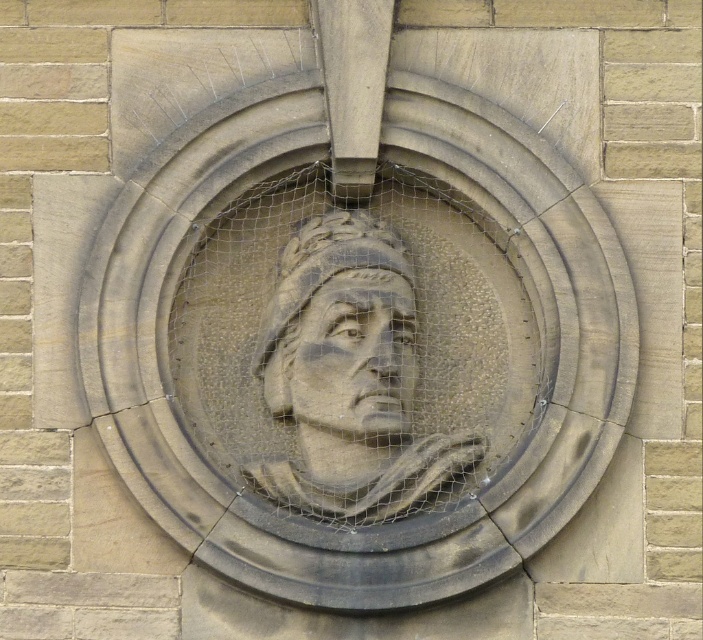
Question: Is stone carving of man at center positioned in front of stone carving head at center?

Choices:
 (A) no
 (B) yes

Answer: (B)

Question: Is stone carving of man at center closer to the viewer compared to stone carving head at center?

Choices:
 (A) no
 (B) yes

Answer: (B)

Question: Is stone carving of man at center in front of stone carving head at center?

Choices:
 (A) no
 (B) yes

Answer: (B)

Question: Which point is closer to the camera?

Choices:
 (A) stone carving of man at center
 (B) stone carving head at center

Answer: (A)